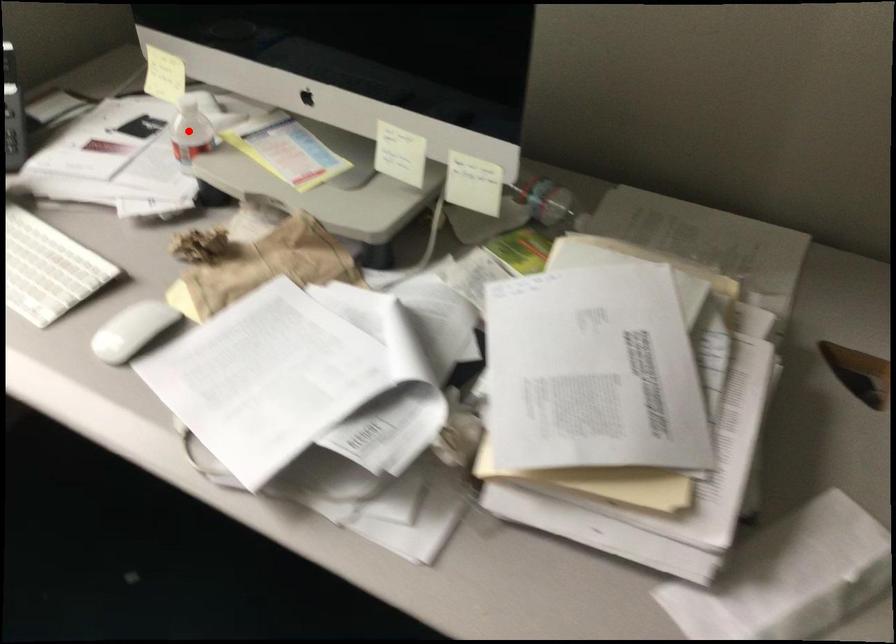
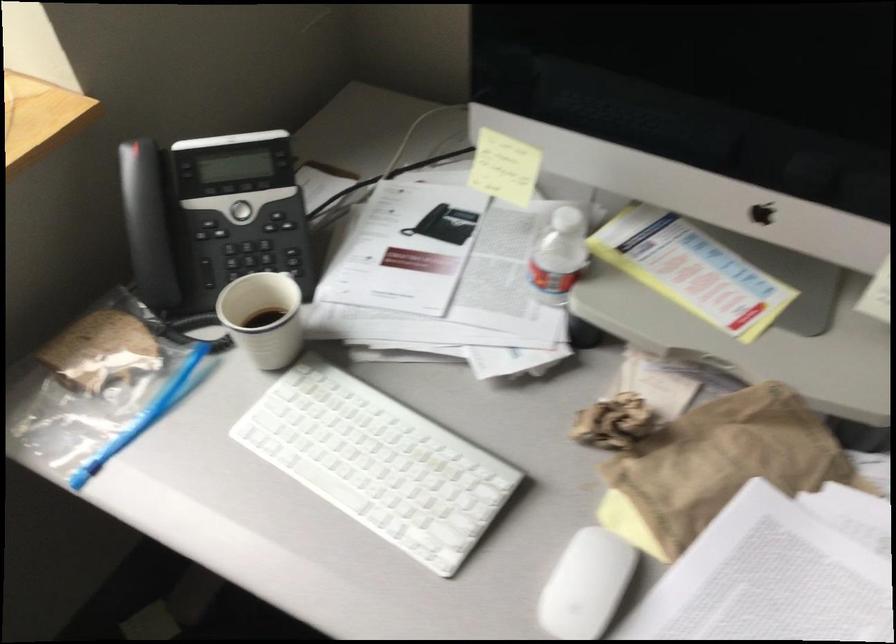
Question: A red point is marked in image1. In image2, is the corresponding 3D point closer to the camera or farther? Reply with the corresponding letter.

Choices:
 (A) The corresponding 3D point is closer.
 (B) The corresponding 3D point is farther.

Answer: (A)